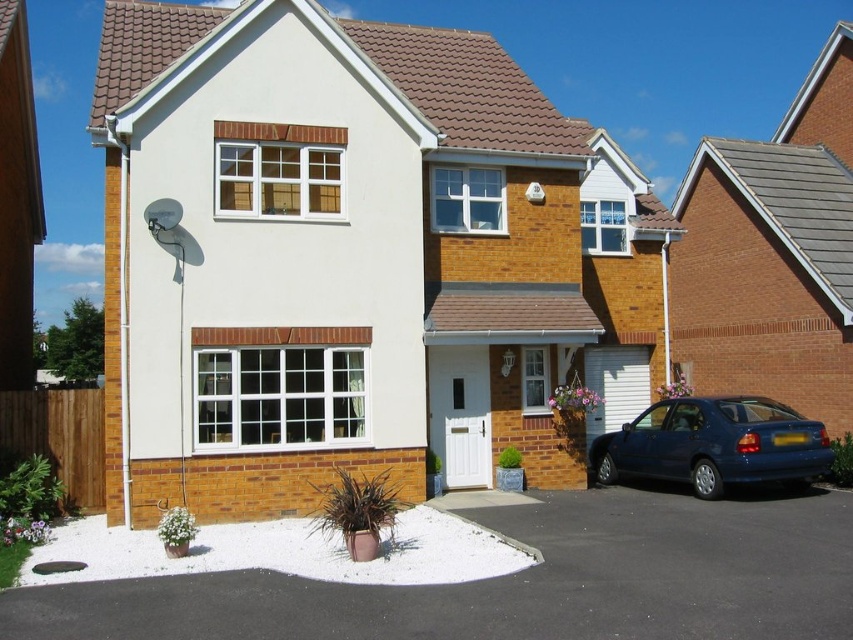
From the picture: You are driving a car and need to park it on the black asphalt driveway at lower center. The glossy blue sedan at lower right is currently blocking the driveway. Can you drive around the sedan to access the driveway?

The black asphalt driveway at lower center is to the left of the glossy blue sedan at lower right, so you can drive around the sedan to the left to access the driveway.

You are standing at the front entrance of the house and want to locate two points marked on the facade. The first point is at coordinates point (798, 528) and the second is at point (646, 456). Which of these two points is closer to you when viewed from the front entrance?

Point (798, 528) is closer to you because it is in front of point (646, 456) when viewed from the front entrance.